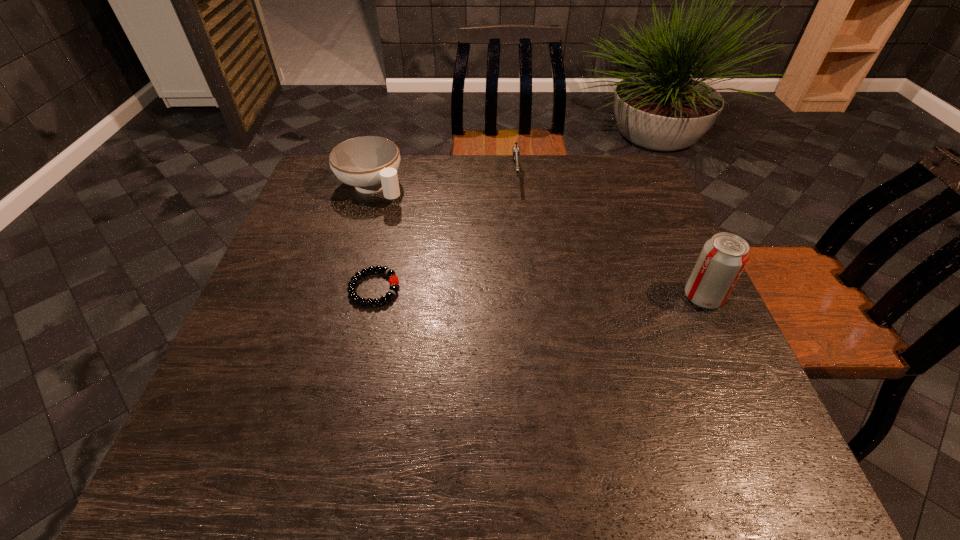
The width and height of the screenshot is (960, 540). What are the coordinates of `free space located 0.190m on the side with the handle of the chinaware` in the screenshot? It's located at (427, 238).

Image resolution: width=960 pixels, height=540 pixels. Find the location of `vacant space located on the front-facing side of the second object from right to left`. vacant space located on the front-facing side of the second object from right to left is located at coordinates (522, 268).

The height and width of the screenshot is (540, 960). I want to click on free space located on the front-facing side of the second object from right to left, so click(x=519, y=228).

This screenshot has width=960, height=540. I want to click on vacant space positioned on the front-facing side of the second object from right to left, so click(x=523, y=286).

At what (x,y) coordinates should I click in order to perform the action: click on chinaware present at the far edge. Please return your answer as a coordinate pair (x, y). Looking at the image, I should click on (369, 163).

Identify the location of pistol present at the far edge. The width and height of the screenshot is (960, 540). (516, 150).

At what (x,y) coordinates should I click in order to perform the action: click on object present at the left edge. Please return your answer as a coordinate pair (x, y). Image resolution: width=960 pixels, height=540 pixels. Looking at the image, I should click on (369, 163).

This screenshot has height=540, width=960. In order to click on object that is positioned at the right edge in this screenshot , I will do `click(723, 257)`.

Identify the location of object situated at the far left corner. Image resolution: width=960 pixels, height=540 pixels. (369, 163).

Find the location of a particular element. This screenshot has width=960, height=540. vacant space at the far edge is located at coordinates (496, 172).